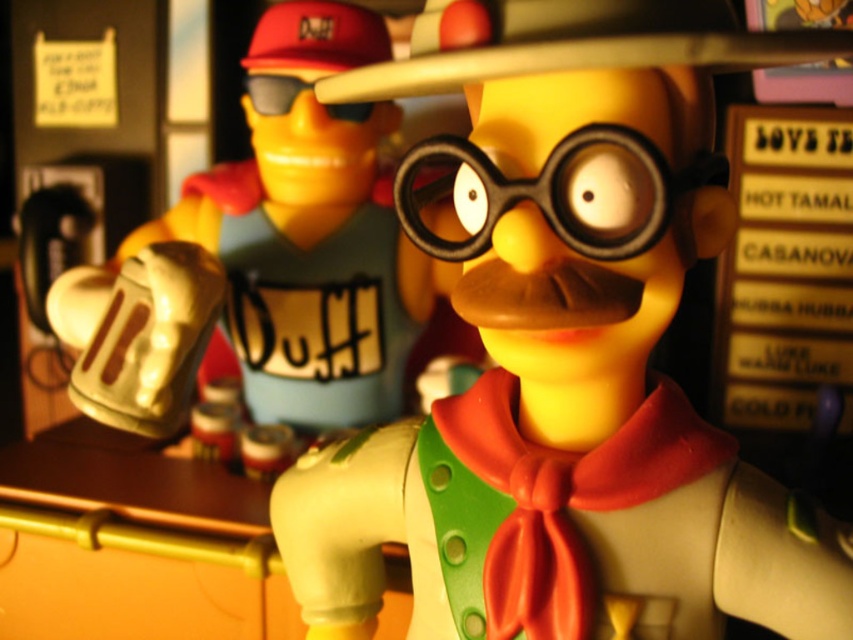
Question: Among these points, which one is farthest from the camera?

Choices:
 (A) (640, 442)
 (B) (572, 180)
 (C) (113, 422)

Answer: (C)

Question: Does matte plastic beer mug at upper left come in front of metallic gold mug at upper left?

Choices:
 (A) no
 (B) yes

Answer: (B)

Question: Is metallic gold mug at upper left behind black matte goggles at upper center?

Choices:
 (A) no
 (B) yes

Answer: (A)

Question: Which of the following is the farthest from the observer?

Choices:
 (A) (582, 195)
 (B) (274, 115)
 (C) (701, 611)

Answer: (B)

Question: From the image, what is the correct spatial relationship of metallic gold mug at upper left in relation to black matte goggles at upper center?

Choices:
 (A) below
 (B) above

Answer: (A)

Question: Which object appears closest to the camera in this image?

Choices:
 (A) matte plastic beer mug at upper left
 (B) black matte goggles at upper center
 (C) metallic gold mug at upper left

Answer: (A)